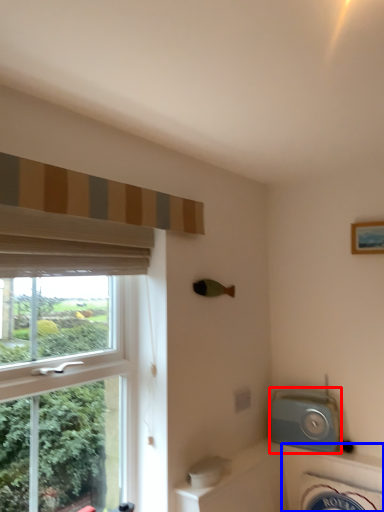
Question: Among these objects, which one is nearest to the camera, appliance (highlighted by a red box) or bath (highlighted by a blue box)?

Choices:
 (A) appliance
 (B) bath

Answer: (B)